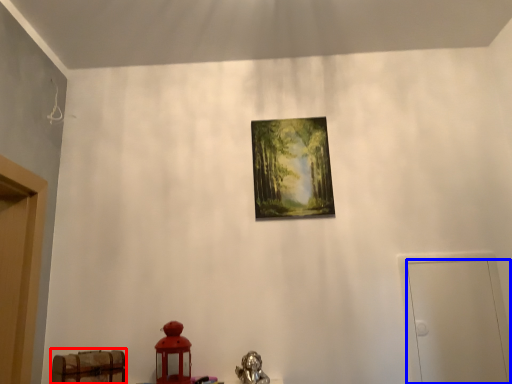
Question: Which object is closer to the camera taking this photo, furniture (highlighted by a red box) or door (highlighted by a blue box)?

Choices:
 (A) furniture
 (B) door

Answer: (A)